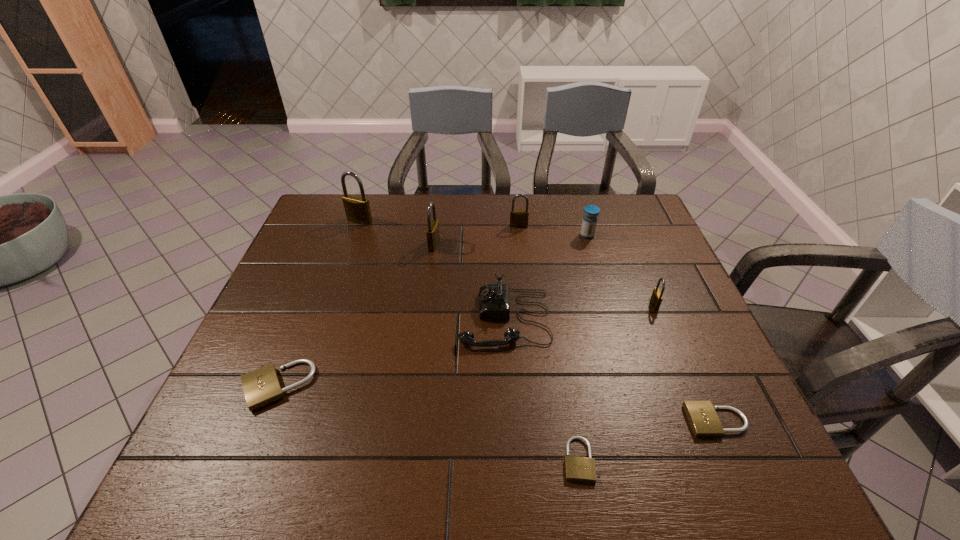
Find the location of a particular element. Image resolution: width=960 pixels, height=540 pixels. vacant area that satisfies the following two spatial constraints: 1. on the back side of the second nearest brass padlock; 2. on the left side of the third biggest brass padlock is located at coordinates (437, 226).